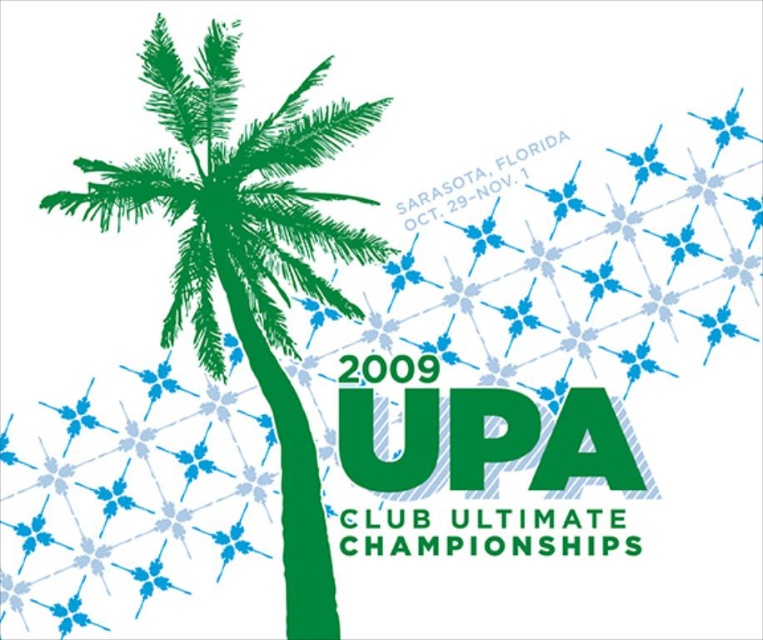
Question: Can you confirm if green ink palm tree at left is thinner than green matte upa logo at center?

Choices:
 (A) yes
 (B) no

Answer: (B)

Question: Is green ink palm tree at left bigger than green matte upa logo at center?

Choices:
 (A) no
 (B) yes

Answer: (B)

Question: From the image, what is the correct spatial relationship of green ink palm tree at left in relation to green matte upa logo at center?

Choices:
 (A) right
 (B) left

Answer: (B)

Question: Which of the following is the farthest from the observer?

Choices:
 (A) green ink palm tree at left
 (B) green matte upa logo at center

Answer: (B)

Question: Which point is farther from the camera taking this photo?

Choices:
 (A) 594,394
 (B) 230,100

Answer: (A)